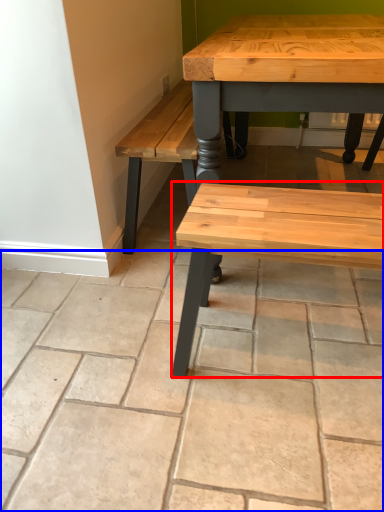
Question: Which of the following is the farthest to the observer, bench (highlighted by a red box) or concrete (highlighted by a blue box)?

Choices:
 (A) bench
 (B) concrete

Answer: (A)